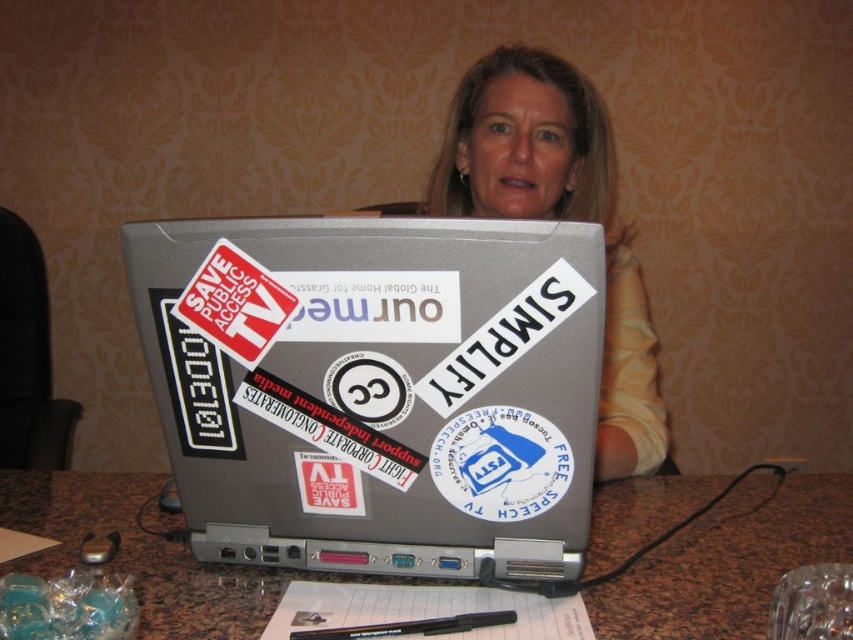
What are the coordinates of the red paper sticker at center?

The red paper sticker at center is located at point (x=235, y=304).

In the scene shown: Based on the scene description, can you determine if the marble table at lower center is wider than the red paper sticker at center?

The marble table at lower center might be wider than red paper sticker at center according to the objects description.